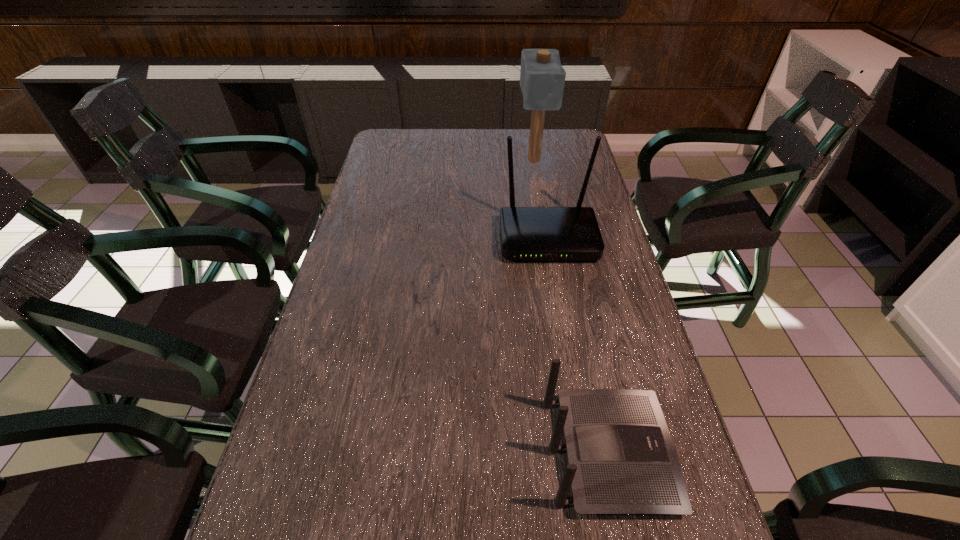
Identify the location of vacant space that satisfies the following two spatial constraints: 1. on the front-facing side of the farther router; 2. on the front-facing side of the shortest object. (584, 453).

You are a GUI agent. You are given a task and a screenshot of the screen. Output one action in this format:
    pyautogui.click(x=<x>, y=<y>)
    Task: Click on the free location that satisfies the following two spatial constraints: 1. on the front-facing side of the shortest object; 2. on the front-facing side of the second nearest object
    This screenshot has height=540, width=960.
    Given the screenshot: What is the action you would take?
    pyautogui.click(x=564, y=239)

In order to click on free space that satisfies the following two spatial constraints: 1. on the front-facing side of the shorter router; 2. on the front-facing side of the taller router in this screenshot , I will do `click(564, 239)`.

You are a GUI agent. You are given a task and a screenshot of the screen. Output one action in this format:
    pyautogui.click(x=<x>, y=<y>)
    Task: Click on the vacant space that satisfies the following two spatial constraints: 1. on the front-facing side of the farther router; 2. on the front-facing side of the nearer router
    
    Given the screenshot: What is the action you would take?
    pyautogui.click(x=584, y=453)

Locate an element on the screen. Image resolution: width=960 pixels, height=540 pixels. vacant area in the image that satisfies the following two spatial constraints: 1. on the front-facing side of the shortest object; 2. on the front-facing side of the second tallest object is located at coordinates (564, 239).